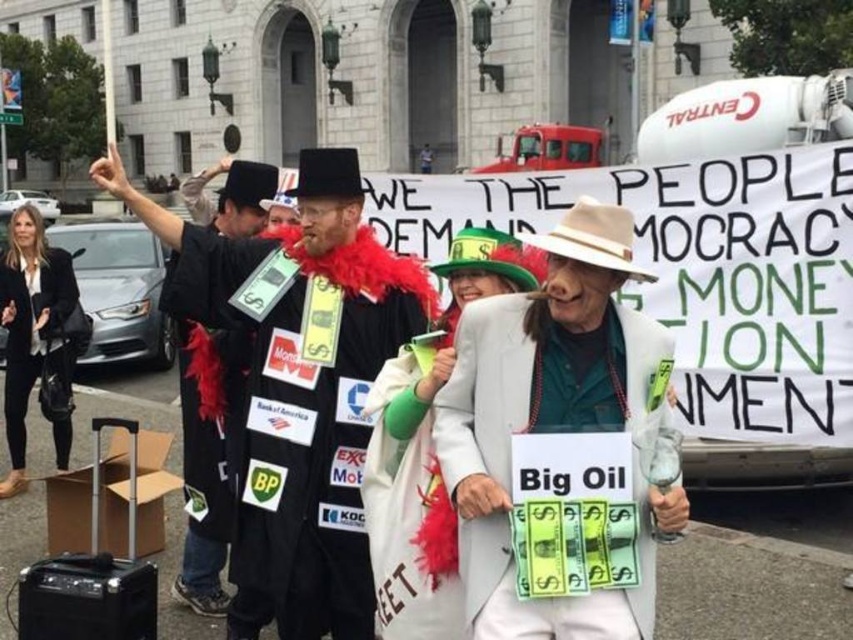
Question: Which of the following is the farthest from the observer?

Choices:
 (A) black felt coat at center
 (B) black fabric coat at center
 (C) black leather jacket at lower left
 (D) white fabric coat at center

Answer: (C)

Question: Is white fabric suit at center above black felt coat at center?

Choices:
 (A) yes
 (B) no

Answer: (A)

Question: Among these points, which one is nearest to the camera?

Choices:
 (A) (224, 600)
 (B) (485, 497)
 (C) (312, 448)

Answer: (B)

Question: Is white fabric coat at center positioned in front of black felt coat at center?

Choices:
 (A) yes
 (B) no

Answer: (A)

Question: Can you confirm if white fabric suit at center is thinner than black felt coat at center?

Choices:
 (A) yes
 (B) no

Answer: (A)

Question: Based on their relative distances, which object is nearer to the black fabric coat at center?

Choices:
 (A) white fabric coat at center
 (B) white fabric suit at center

Answer: (A)